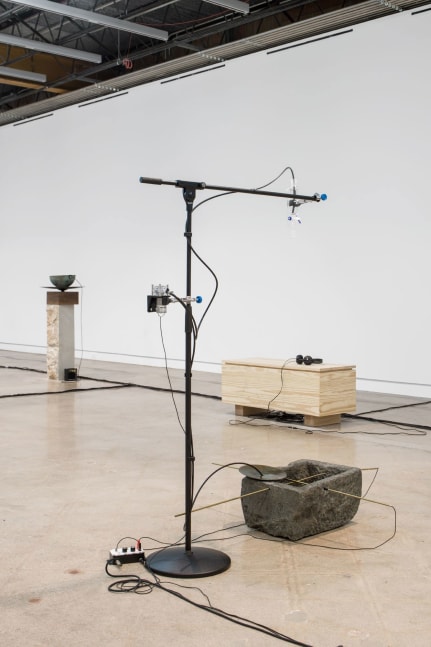
This screenshot has height=647, width=431. Find the location of `stand`. stand is located at coordinates (188, 272).